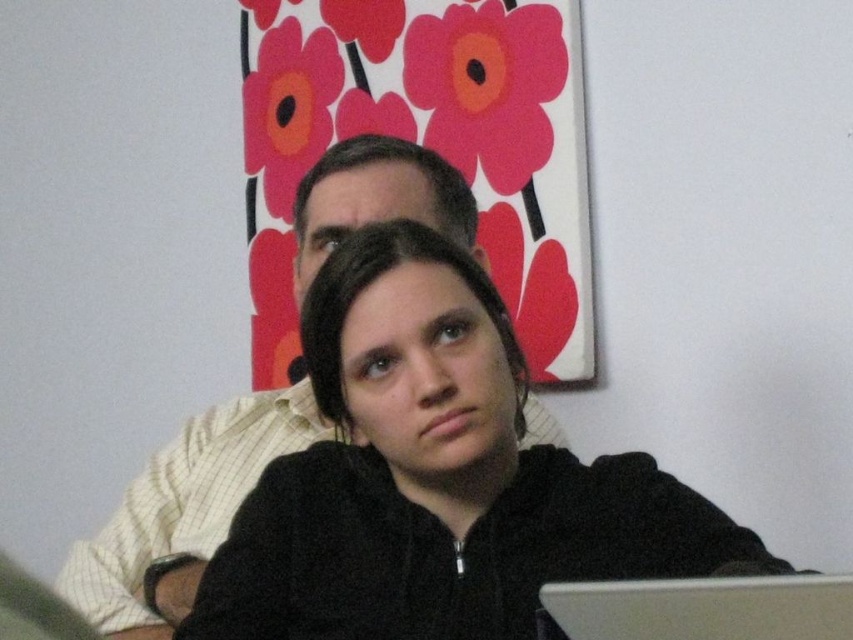
In the scene shown: You are trying to decide whether to place a new plant pot between the light yellow checkered shirt at center and the silver metallic laptop at lower center. Based on their sizes, will the plant pot fit between them?

The light yellow checkered shirt at center is much taller than the silver metallic laptop at lower center, so the plant pot may fit between them depending on the pot size and the space available horizontally. However, the description only mentions height differences, not width, so further information is needed.

Where is the black matte jacket at center located in the image?

The black matte jacket at center is located at point (x=437, y=476).

Based on the scene description, where is the light yellow checkered shirt at center positioned in relation to the other objects?

The light yellow checkered shirt at center is located at point 0.802 on the x axis and 0.215 on the y axis.